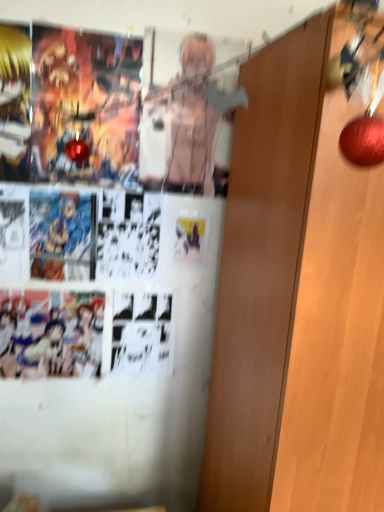
This screenshot has height=512, width=384. What are the coordinates of `wooden door at right` in the screenshot? It's located at (261, 265).

This screenshot has width=384, height=512. What do you see at coordinates (261, 265) in the screenshot?
I see `wooden door at right` at bounding box center [261, 265].

What do you see at coordinates (14, 102) in the screenshot? I see `golden hair anime character at left` at bounding box center [14, 102].

This screenshot has height=512, width=384. Find the location of `golden hair anime character at left`. golden hair anime character at left is located at coordinates (14, 102).

At what (x,y) coordinates should I click in order to perform the action: click on wooden door at right. Please return your answer as a coordinate pair (x, y). Looking at the image, I should click on (261, 265).

Between golden hair anime character at left and wooden door at right, which one appears on the left side from the viewer's perspective?

From the viewer's perspective, golden hair anime character at left appears more on the left side.

Does golden hair anime character at left lie in front of wooden door at right?

No, golden hair anime character at left is further to the viewer.

Is point (4, 93) positioned after point (280, 234)?

Yes.

From the image's perspective, which is above, golden hair anime character at left or wooden door at right?

From the image's view, golden hair anime character at left is above.

From a real-world perspective, is golden hair anime character at left positioned above or below wooden door at right?

golden hair anime character at left is situated higher than wooden door at right in the real world.

From the picture: Considering the relative sizes of golden hair anime character at left and wooden door at right in the image provided, is golden hair anime character at left thinner than wooden door at right?

Indeed, golden hair anime character at left has a lesser width compared to wooden door at right.

From the picture: Which of these two, golden hair anime character at left or wooden door at right, stands shorter?

golden hair anime character at left.

Between golden hair anime character at left and wooden door at right, which one has larger size?

With larger size is wooden door at right.

Is golden hair anime character at left inside or outside of wooden door at right?

golden hair anime character at left is located beyond the bounds of wooden door at right.

Is golden hair anime character at left far away from wooden door at right?

No, golden hair anime character at left is in close proximity to wooden door at right.

Is golden hair anime character at left oriented towards wooden door at right?

No, golden hair anime character at left is not oriented towards wooden door at right.

Can you tell me how much golden hair anime character at left and wooden door at right differ in facing direction?

They differ by 1.78 degrees in their facing directions.

Locate an element on the screen. The height and width of the screenshot is (512, 384). person on the left of wooden door at right is located at coordinates (14, 102).

Is wooden door at right at the right side of golden hair anime character at left?

Correct, you'll find wooden door at right to the right of golden hair anime character at left.

Is wooden door at right positioned behind golden hair anime character at left?

That is False.

Which is less distant, (240, 420) or (1, 149)?

The point (240, 420) is in front.

From the image's perspective, which is above, wooden door at right or golden hair anime character at left?

golden hair anime character at left is shown above in the image.

From a real-world perspective, which object rests below the other?

In real-world perspective, wooden door at right is lower.

Looking at this image, considering the sizes of objects wooden door at right and golden hair anime character at left in the image provided, who is wider, wooden door at right or golden hair anime character at left?

With larger width is wooden door at right.

Can you confirm if wooden door at right is taller than golden hair anime character at left?

Yes, wooden door at right is taller than golden hair anime character at left.

Can you confirm if wooden door at right is bigger than golden hair anime character at left?

Indeed, wooden door at right has a larger size compared to golden hair anime character at left.

Would you say wooden door at right is inside or outside golden hair anime character at left?

Answer: wooden door at right is outside golden hair anime character at left.

Is there a large distance between wooden door at right and golden hair anime character at left?

No, there isn't a large distance between wooden door at right and golden hair anime character at left.

Is wooden door at right positioned with its back to golden hair anime character at left?

No, golden hair anime character at left is not at the back of wooden door at right.

How different are the orientations of wooden door at right and golden hair anime character at left in degrees?

There is a 1.78-degree angle between the facing directions of wooden door at right and golden hair anime character at left.

Measure the distance between wooden door at right and golden hair anime character at left.

wooden door at right and golden hair anime character at left are 74.91 centimeters apart.

At what (x,y) coordinates should I click in order to perform the action: click on person behind the wooden door at right. Please return your answer as a coordinate pair (x, y). This screenshot has height=512, width=384. Looking at the image, I should click on (14, 102).

I want to click on door on the right of golden hair anime character at left, so click(x=261, y=265).

Find the location of a particular element. The height and width of the screenshot is (512, 384). person behind the wooden door at right is located at coordinates (14, 102).